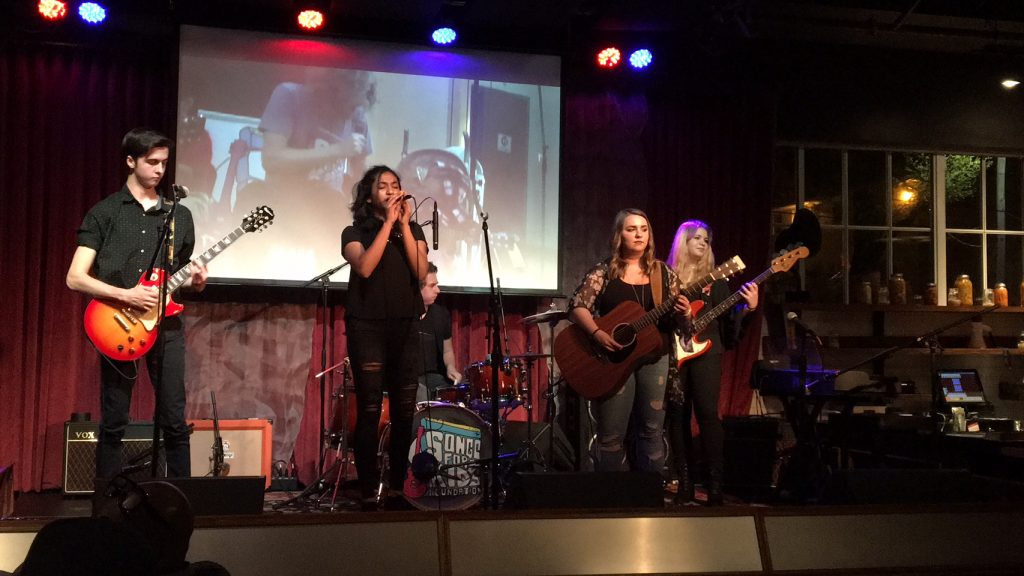
You are a GUI agent. You are given a task and a screenshot of the screen. Output one action in this format:
    pyautogui.click(x=<x>, y=<y>)
    Task: Click on the vox amplifier
    The width and height of the screenshot is (1024, 576).
    Given the screenshot: What is the action you would take?
    pyautogui.click(x=82, y=467)